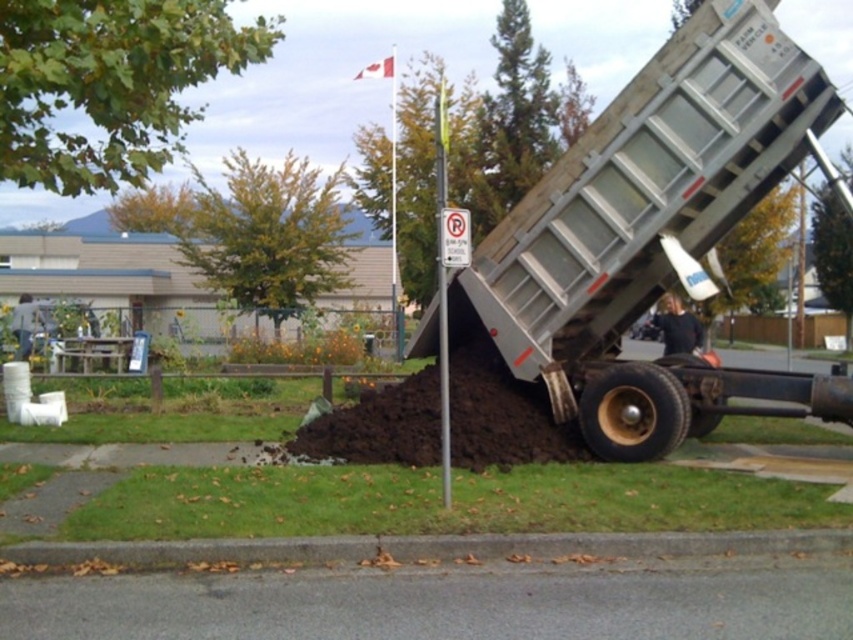
You are a landscape architect assessing the site. The dark brown soil at center and the green leafy tree at upper right are both critical to your design plan. Which object is taller, and how might this affect the placement of new structures?

The green leafy tree at upper right is taller than the dark brown soil at center. This means that any new structures placed near the tree must consider its height to avoid obstruction and ensure compliance with local tree preservation regulations.